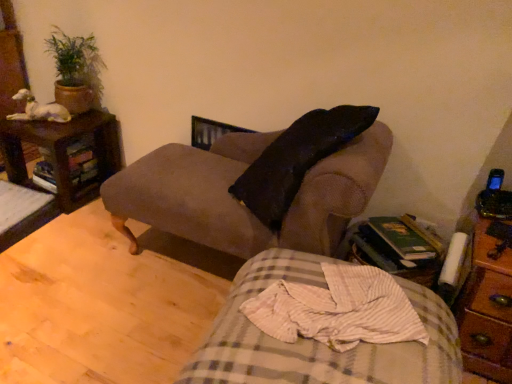
Image resolution: width=512 pixels, height=384 pixels. I want to click on vacant space that is to the left of suede-like brown couch at center, so click(78, 276).